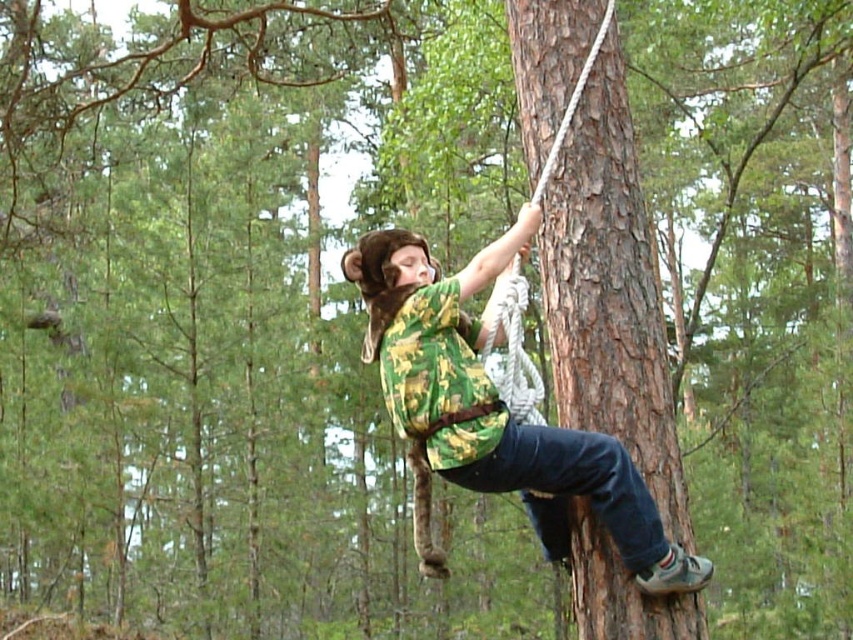
Does brown rough tree trunk at center have a smaller size compared to camouflage fabric shirt at center?

Actually, brown rough tree trunk at center might be larger than camouflage fabric shirt at center.

Can you confirm if brown rough tree trunk at center is taller than camouflage fabric shirt at center?

Yes, brown rough tree trunk at center is taller than camouflage fabric shirt at center.

Describe the element at coordinates (608, 292) in the screenshot. I see `brown rough tree trunk at center` at that location.

Locate an element on the screen. This screenshot has width=853, height=640. brown rough tree trunk at center is located at coordinates (608, 292).